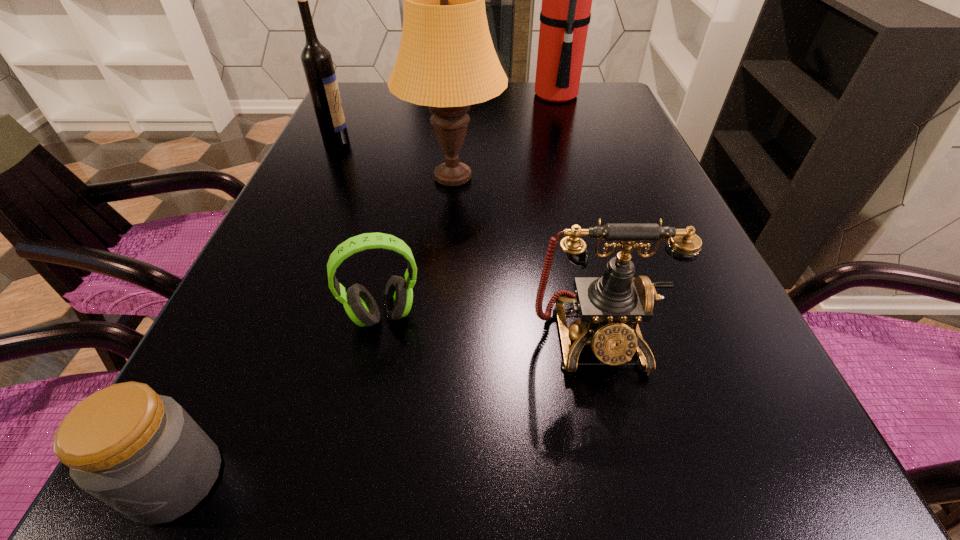
Locate an element on the screen. Image resolution: width=960 pixels, height=540 pixels. vacant space that is in between the fire extinguisher and the lampshade is located at coordinates (505, 137).

Where is `free space between the headset and the tallest object`? free space between the headset and the tallest object is located at coordinates [469, 205].

This screenshot has height=540, width=960. What are the coordinates of `free space between the headset and the farthest object` in the screenshot? It's located at (469, 205).

Locate an element on the screen. vacant area that lies between the headset and the jar is located at coordinates (279, 397).

The image size is (960, 540). Identify the location of vacant space in between the lampshade and the farthest object. (505, 137).

You are a GUI agent. You are given a task and a screenshot of the screen. Output one action in this format:
    pyautogui.click(x=<x>, y=<y>)
    Task: Click on the second closest object to the farthest object
    
    Given the screenshot: What is the action you would take?
    (x=317, y=63)

At what (x,y) coordinates should I click in order to perform the action: click on the closest object to the lampshade. Please return your answer as a coordinate pair (x, y). The image size is (960, 540). Looking at the image, I should click on (317, 63).

Where is `free space that satisfies the following two spatial constraints: 1. at the nozzle of the farthest object; 2. on the front of the telephone, featuring the rotary dial`? Image resolution: width=960 pixels, height=540 pixels. free space that satisfies the following two spatial constraints: 1. at the nozzle of the farthest object; 2. on the front of the telephone, featuring the rotary dial is located at coordinates [627, 338].

Where is `free space that satisfies the following two spatial constraints: 1. at the nozzle of the farthest object; 2. on the surface of the nearest object near the warning symbol`? Image resolution: width=960 pixels, height=540 pixels. free space that satisfies the following two spatial constraints: 1. at the nozzle of the farthest object; 2. on the surface of the nearest object near the warning symbol is located at coordinates (669, 479).

Where is `free spot that satisfies the following two spatial constraints: 1. on the label of the fifth nearest object; 2. on the right side of the headset`? This screenshot has height=540, width=960. free spot that satisfies the following two spatial constraints: 1. on the label of the fifth nearest object; 2. on the right side of the headset is located at coordinates (253, 315).